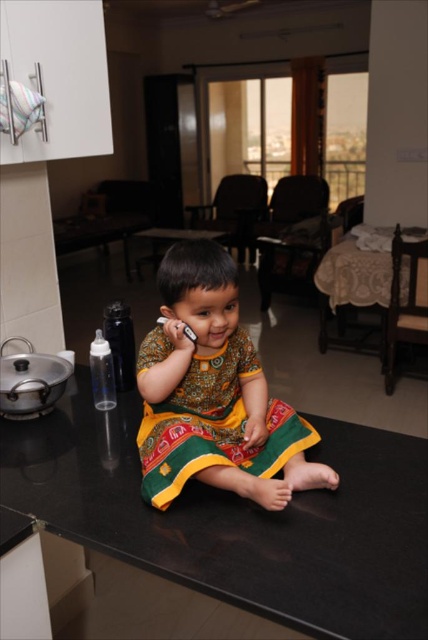
Question: Can you confirm if black granite table at lower center is bigger than wooden table at center?

Choices:
 (A) no
 (B) yes

Answer: (A)

Question: Is black granite table at lower center wider than printed cotton dress at center?

Choices:
 (A) yes
 (B) no

Answer: (A)

Question: Observing the image, what is the correct spatial positioning of black granite table at lower center in reference to printed cotton dress at center?

Choices:
 (A) left
 (B) right

Answer: (A)

Question: Among these points, which one is farthest from the camera?

Choices:
 (A) (336, 566)
 (B) (243, 406)
 (C) (377, 282)

Answer: (C)

Question: Which object appears farthest from the camera in this image?

Choices:
 (A) wooden table at center
 (B) printed cotton dress at center

Answer: (A)

Question: Which point is closer to the camera?

Choices:
 (A) (342, 291)
 (B) (376, 561)
 (C) (250, 387)

Answer: (B)